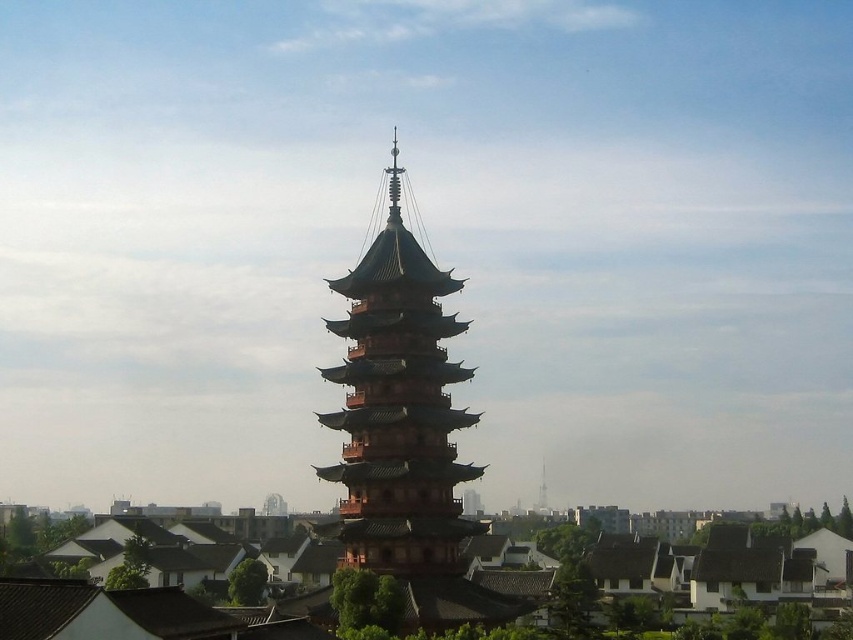
You are standing at the entrance of a garden and see the brown wooden pagoda at center. If you walk straight ahead, will you move closer to the pagoda?

Yes, walking straight ahead from the entrance will move you closer to the brown wooden pagoda at center since it is positioned directly ahead at point (398,410).

You are an architect analyzing the structure of the brown wooden pagoda at center and the smooth white spire at center. Which one has a greater height?

The brown wooden pagoda at center is larger in size than smooth white spire at center, so it has a greater height.

You are standing in front of the brown wooden pagoda at center and want to look at the smooth white spire at center. Which direction should you move to get a better view of the spire?

The smooth white spire at center is behind the brown wooden pagoda at center, so you should move backward to get a better view of the spire.